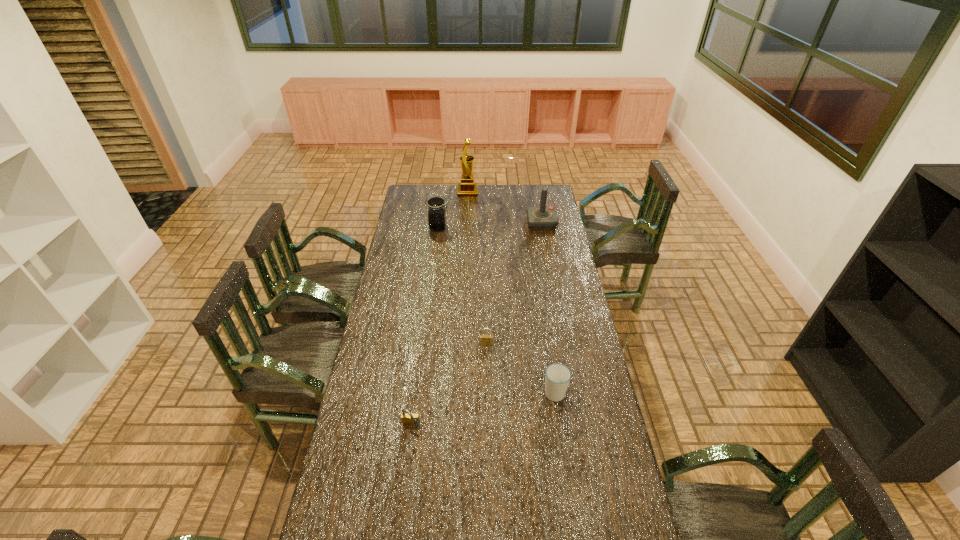
Locate an element on the screen. object at the left edge is located at coordinates (437, 212).

What are the coordinates of `joystick that is at the right edge` in the screenshot? It's located at (542, 217).

Where is `cup located in the right edge section of the desktop`? cup located in the right edge section of the desktop is located at coordinates click(557, 376).

In the image, there is a desktop. Where is `free space at the far edge`? Image resolution: width=960 pixels, height=540 pixels. free space at the far edge is located at coordinates (484, 192).

This screenshot has height=540, width=960. Find the location of `free spot at the left edge of the desktop`. free spot at the left edge of the desktop is located at coordinates (411, 277).

I want to click on vacant space at the right edge, so click(x=561, y=238).

Find the location of a particular element. The image size is (960, 540). unoccupied position between the right padlock and the jar is located at coordinates (462, 286).

You are a GUI agent. You are given a task and a screenshot of the screen. Output one action in this format:
    pyautogui.click(x=<x>, y=<y>)
    Task: Click on the free space between the third object from left to right and the right padlock
    The image size is (960, 540).
    Given the screenshot: What is the action you would take?
    pyautogui.click(x=477, y=268)

I want to click on free point between the third nearest object and the second tallest object, so click(514, 284).

In order to click on empty space that is in between the right padlock and the nearest object in this screenshot , I will do `click(449, 385)`.